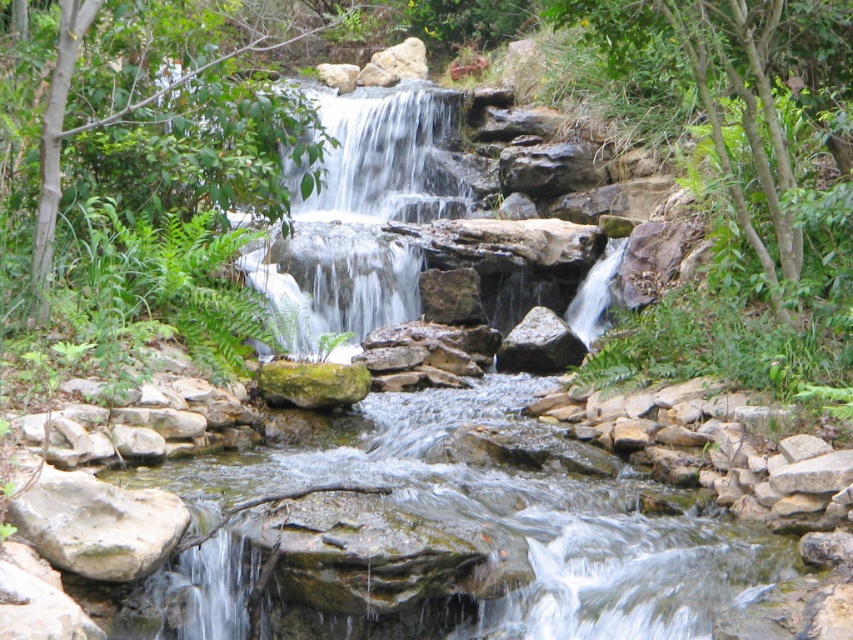
You are a hiker carrying a backpack and need to cross the stream between the green mossy rock at center and the gray rough rock at lower left. The stream is 3 feet wide. Can you safely cross the stream if your backpack is 2.5 feet wide?

The stream between the green mossy rock at center and the gray rough rock at lower left is 9.15 feet wide. Since your backpack is only 2.5 feet wide, you can safely cross the stream as the width of the stream is more than sufficient to accommodate your backpack.

You are standing at the edge of the waterfall and see the green mossy rock at center and the white textured water at center. Which object is positioned higher in the scene?

The white textured water at center is higher than the green mossy rock at center because the green mossy rock at center is below the white textured water at center.

You are standing at the origin point of the coordinate system in the waterfall scene. You want to place a decorative statue on the green mossy rock at center. What are the coordinates where you should place the statue?

The coordinates for the green mossy rock at center are at point (517, 518), so you should place the statue there.